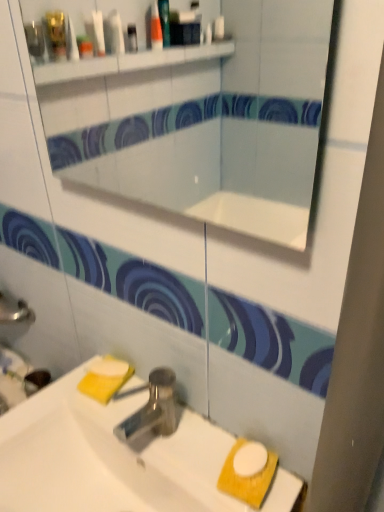
Locate an element on the screen. The height and width of the screenshot is (512, 384). white matte soap at lower center is located at coordinates (109, 367).

Image resolution: width=384 pixels, height=512 pixels. Find the location of `polished metallic tap at center`. polished metallic tap at center is located at coordinates (153, 408).

Consider the image. Measure the distance between white glossy mirror at upper center and camera.

white glossy mirror at upper center is 1.34 meters from camera.

This screenshot has width=384, height=512. Find the location of `white matte soap at lower center`. white matte soap at lower center is located at coordinates (109, 367).

Could white matte soap at lower center be considered to be inside white glossy mirror at upper center?

No.

Can you tell me how much white glossy mirror at upper center and white matte soap at lower center differ in facing direction?

28.9 degrees.

Is white glossy mirror at upper center facing away from white matte soap at lower center?

No, white glossy mirror at upper center is not facing away from white matte soap at lower center.

Are white glossy mirror at upper center and white matte soap at lower center beside each other?

white glossy mirror at upper center and white matte soap at lower center are clearly separated.

How different are the orientations of polished metallic tap at center and white matte soap at lower center in degrees?

They differ by 29.2 degrees in their facing directions.

Who is bigger, polished metallic tap at center or white matte soap at lower center?

polished metallic tap at center.

Is polished metallic tap at center far from white matte soap at lower center?

No, polished metallic tap at center is not far from white matte soap at lower center.

From the image's perspective, between polished metallic tap at center and white matte soap at lower center, who is located below?

polished metallic tap at center, from the image's perspective.

Considering the positions of point (79, 410) and point (123, 432), is point (79, 410) closer or farther from the camera than point (123, 432)?

Point (79, 410).

Where is `sink in front of the polished metallic tap at center`? sink in front of the polished metallic tap at center is located at coordinates (106, 457).

In terms of size, does white glossy sink at lower center appear bigger or smaller than polished metallic tap at center?

Considering their sizes, white glossy sink at lower center takes up more space than polished metallic tap at center.

Is white glossy sink at lower center completely or partially outside of polished metallic tap at center?

white glossy sink at lower center lies outside polished metallic tap at center's area.

From the image's perspective, relative to white glossy mirror at upper center, is white matte soap at lower center above or below?

Clearly, from the image's perspective, white matte soap at lower center is below white glossy mirror at upper center.

Does white matte soap at lower center have a greater height compared to white glossy mirror at upper center?

No.

From the picture: Is white matte soap at lower center to the right of white glossy mirror at upper center from the viewer's perspective?

Incorrect, white matte soap at lower center is not on the right side of white glossy mirror at upper center.

Which is behind, white matte soap at lower center or white glossy mirror at upper center?

white matte soap at lower center is further away from the camera.

In the image, there is a polished metallic tap at center. At what (x,y) coordinates should I click in order to perform the action: click on mirror above it (from the image's perspective). Please return your answer as a coordinate pair (x, y). Looking at the image, I should click on (201, 120).

Is polished metallic tap at center looking in the opposite direction of white glossy mirror at upper center?

No, white glossy mirror at upper center is not at the back of polished metallic tap at center.

Does polished metallic tap at center have a smaller size compared to white glossy mirror at upper center?

Correct, polished metallic tap at center occupies less space than white glossy mirror at upper center.

Which of these two, white glossy sink at lower center or white matte soap at lower center, is bigger?

white glossy sink at lower center.

At what (x,y) coordinates should I click in order to perform the action: click on sink below the white matte soap at lower center (from a real-world perspective). Please return your answer as a coordinate pair (x, y). The height and width of the screenshot is (512, 384). Looking at the image, I should click on (106, 457).

Are white glossy sink at lower center and white matte soap at lower center located far from each other?

No.

Does white glossy sink at lower center have a greater height compared to white matte soap at lower center?

Yes, white glossy sink at lower center is taller than white matte soap at lower center.

Which object is thinner, white glossy sink at lower center or white glossy mirror at upper center?

white glossy mirror at upper center is thinner.

The height and width of the screenshot is (512, 384). I want to click on mirror that appears on the right of white glossy sink at lower center, so click(201, 120).

Does white glossy sink at lower center turn towards white glossy mirror at upper center?

No.

Is white glossy sink at lower center to the right of white glossy mirror at upper center from the viewer's perspective?

No, white glossy sink at lower center is not to the right of white glossy mirror at upper center.

Identify the location of soap that is behind the white glossy mirror at upper center. (109, 367).

At what (x,y) coordinates should I click in order to perform the action: click on tap that appears below the white matte soap at lower center (from the image's perspective). Please return your answer as a coordinate pair (x, y). The width and height of the screenshot is (384, 512). Looking at the image, I should click on (153, 408).

Based on their spatial positions, is white matte soap at lower center or white glossy sink at lower center closer to polished metallic tap at center?

The object closer to polished metallic tap at center is white glossy sink at lower center.

Consider the image. Based on their spatial positions, is white glossy sink at lower center or white matte soap at lower center closer to polished metallic tap at center?

white glossy sink at lower center lies closer to polished metallic tap at center than the other object.

Consider the image. Considering their positions, is white glossy mirror at upper center positioned closer to white glossy sink at lower center than polished metallic tap at center?

Based on the image, polished metallic tap at center appears to be nearer to white glossy sink at lower center.

Estimate the real-world distances between objects in this image. Which object is further from polished metallic tap at center, white glossy mirror at upper center or white glossy sink at lower center?

white glossy mirror at upper center is positioned further to the anchor polished metallic tap at center.

Considering their positions, is white matte soap at lower center positioned further to white glossy mirror at upper center than polished metallic tap at center?

polished metallic tap at center.

When comparing their distances from white glossy sink at lower center, does polished metallic tap at center or white matte soap at lower center seem further?

white matte soap at lower center is positioned further to the anchor white glossy sink at lower center.

Based on their spatial positions, is white glossy mirror at upper center or white matte soap at lower center closer to polished metallic tap at center?

white matte soap at lower center.

Based on their spatial positions, is white matte soap at lower center or polished metallic tap at center closer to white glossy sink at lower center?

Among the two, polished metallic tap at center is located nearer to white glossy sink at lower center.

This screenshot has height=512, width=384. Identify the location of tap between white glossy mirror at upper center and white glossy sink at lower center from top to bottom. (153, 408).

Locate an element on the screen. soap between white glossy mirror at upper center and white glossy sink at lower center in the vertical direction is located at coordinates (109, 367).

Where is `tap between white glossy sink at lower center and white matte soap at lower center in the front-back direction`? This screenshot has width=384, height=512. tap between white glossy sink at lower center and white matte soap at lower center in the front-back direction is located at coordinates (153, 408).

The height and width of the screenshot is (512, 384). I want to click on soap between white glossy mirror at upper center and polished metallic tap at center in the vertical direction, so click(x=109, y=367).